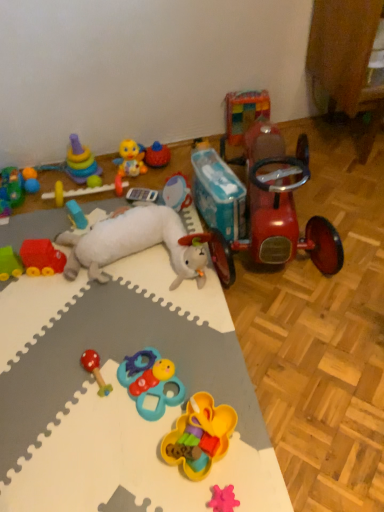
Identify the location of free space in front of white plush toy at center, the seventh toy when ordered from left to right. (111, 340).